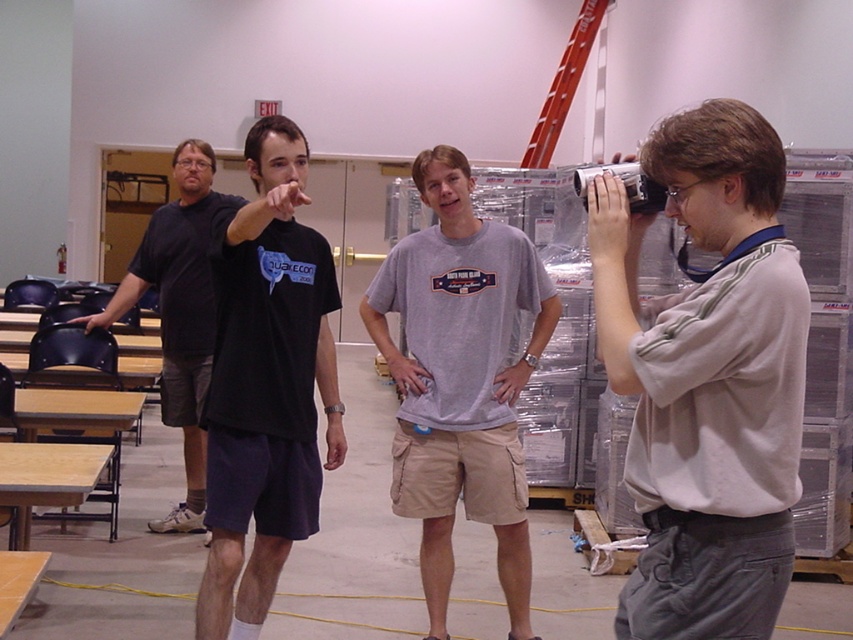
Which is behind, point (525, 298) or point (236, 458)?

Positioned behind is point (525, 298).

Is point (502, 568) positioned after point (309, 492)?

Yes, it is behind point (309, 492).

You are a GUI agent. You are given a task and a screenshot of the screen. Output one action in this format:
    pyautogui.click(x=<x>, y=<y>)
    Task: Click on the gray cotton t-shirt at center
    This screenshot has height=640, width=853.
    Given the screenshot: What is the action you would take?
    pyautogui.click(x=460, y=378)

Which is more to the right, gray cotton t-shirt at center or metallic silver ladder at upper right?

metallic silver ladder at upper right is more to the right.

Can you confirm if gray cotton t-shirt at center is smaller than metallic silver ladder at upper right?

Yes.

What do you see at coordinates (460, 378) in the screenshot? This screenshot has height=640, width=853. I see `gray cotton t-shirt at center` at bounding box center [460, 378].

What are the coordinates of `gray cotton t-shirt at center` in the screenshot? It's located at (460, 378).

Does black cotton t-shirt at left appear over metallic silver ladder at upper right?

No, black cotton t-shirt at left is not above metallic silver ladder at upper right.

Image resolution: width=853 pixels, height=640 pixels. What do you see at coordinates (178, 310) in the screenshot? I see `black cotton t-shirt at left` at bounding box center [178, 310].

Does point (198, 388) lie in front of point (575, 36)?

Yes, point (198, 388) is in front of point (575, 36).

You are a GUI agent. You are given a task and a screenshot of the screen. Output one action in this format:
    pyautogui.click(x=<x>, y=<y>)
    Task: Click on the black cotton t-shirt at left
    
    Given the screenshot: What is the action you would take?
    pyautogui.click(x=178, y=310)